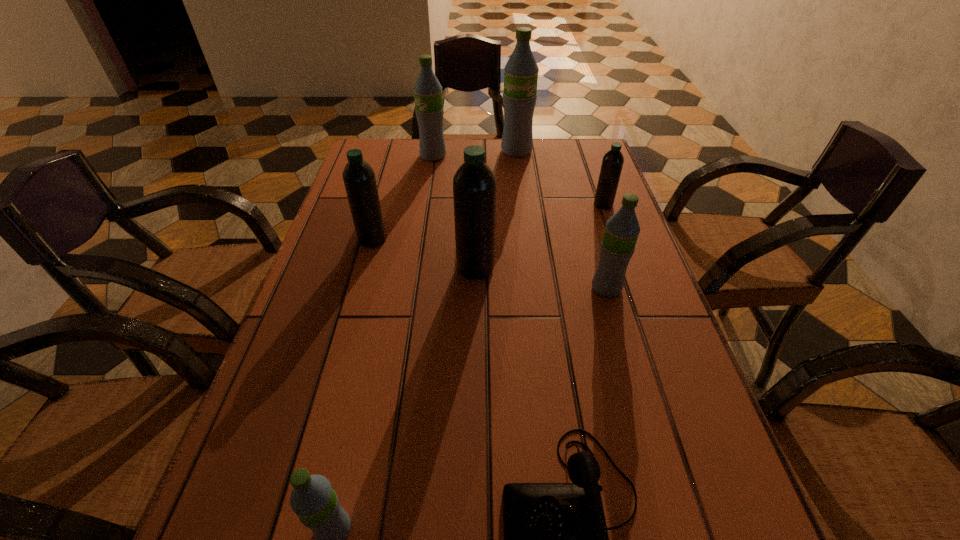
You are a GUI agent. You are given a task and a screenshot of the screen. Output one action in this format:
    pyautogui.click(x=<x>, y=<y>)
    Task: Click on the rightmost black water bottle
    The width and height of the screenshot is (960, 540).
    Given the screenshot: What is the action you would take?
    pyautogui.click(x=612, y=163)

You are a GUI agent. You are given a task and a screenshot of the screen. Output one action in this format:
    pyautogui.click(x=<x>, y=<y>)
    Task: Click on the vacant region located on the front of the biggest green water bottle
    Image resolution: width=960 pixels, height=540 pixels.
    Given the screenshot: What is the action you would take?
    pyautogui.click(x=520, y=181)

This screenshot has height=540, width=960. In order to click on vacant position located 0.160m on the left of the third smallest green water bottle in this screenshot , I will do `click(370, 156)`.

I want to click on free region located on the front of the fourth object from left to right, so click(475, 321).

The width and height of the screenshot is (960, 540). In order to click on blank space located 0.090m on the right of the fourth farthest water bottle in this screenshot , I will do pos(422,240).

Find the location of a particular element. The height and width of the screenshot is (540, 960). vacant space located 0.360m on the back of the second nearest green water bottle is located at coordinates (578, 190).

The width and height of the screenshot is (960, 540). What are the coordinates of `vacant region located 0.230m on the back of the sixth nearest object` in the screenshot? It's located at (587, 158).

You are a GUI agent. You are given a task and a screenshot of the screen. Output one action in this format:
    pyautogui.click(x=<x>, y=<y>)
    Task: Click on the object that is at the left edge
    
    Given the screenshot: What is the action you would take?
    pyautogui.click(x=359, y=179)

Image resolution: width=960 pixels, height=540 pixels. I want to click on vacant space at the far edge of the desktop, so click(464, 138).

In the image, there is a desktop. Identify the location of vacant space at the right edge. This screenshot has height=540, width=960. (577, 203).